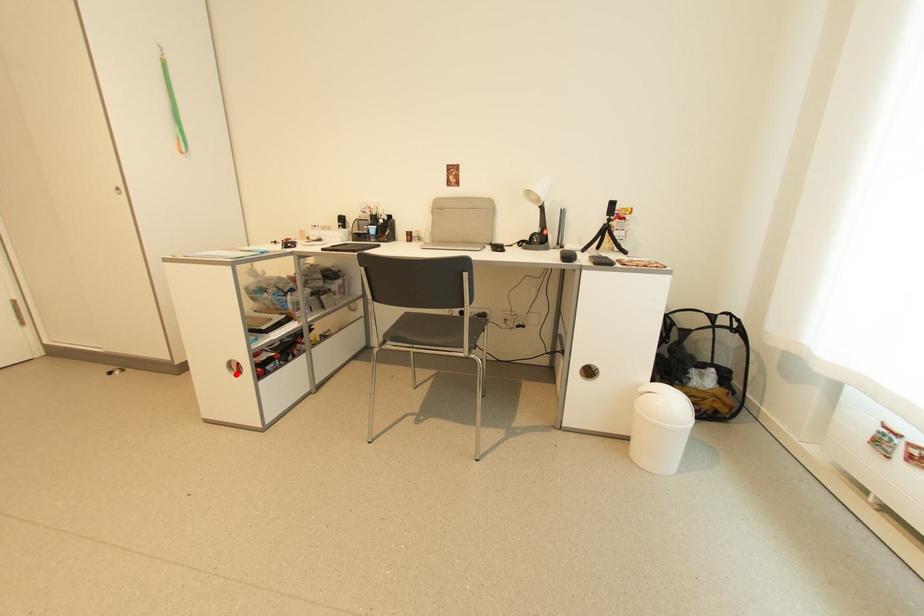
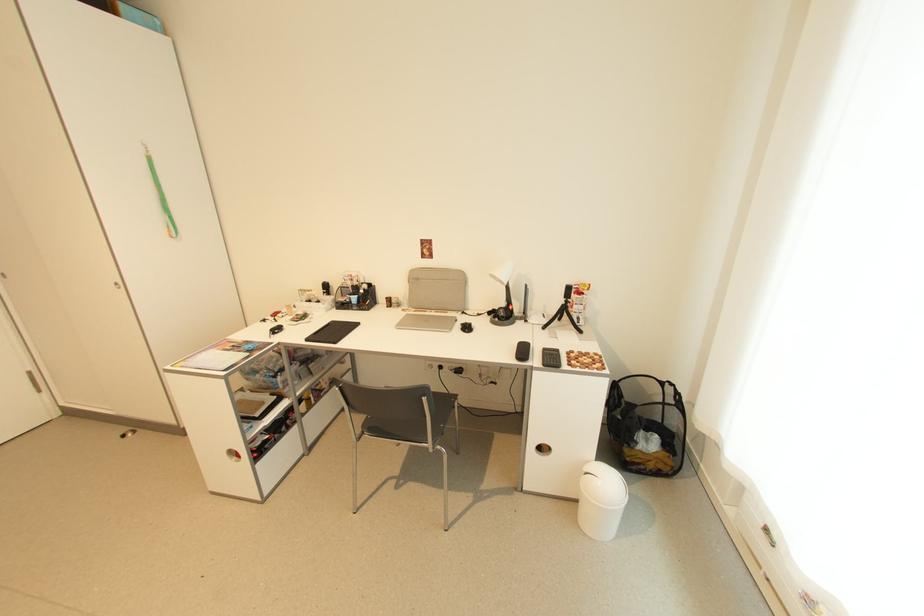
Question: I am providing you with two images of the same scene from different viewpoints. Given a red point in image1, look at the same physical point in image2. Is it:

Choices:
 (A) Closer to the viewpoint
 (B) Farther from the viewpoint

Answer: (B)